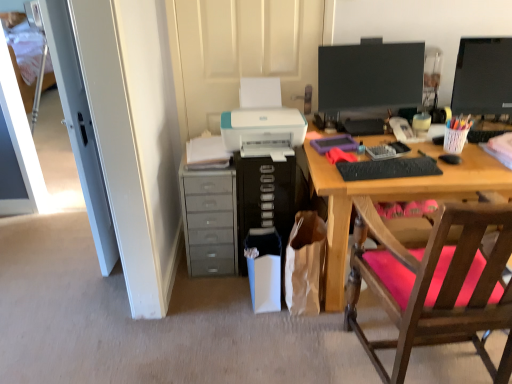
Find the location of a particular element. The image size is (512, 384). black plastic computer tower at center is located at coordinates (264, 197).

Measure the distance between point (324, 138) and camera.

2.19 meters.

Describe the element at coordinates (209, 220) in the screenshot. The height and width of the screenshot is (384, 512). I see `gray plastic drawers at lower left` at that location.

You are a GUI agent. You are given a task and a screenshot of the screen. Output one action in this format:
    pyautogui.click(x=<x>, y=<y>)
    Task: Click on the matte black monitor at upper right, the 1th computer monitor from the right
    This screenshot has height=384, width=512.
    Given the screenshot: What is the action you would take?
    pyautogui.click(x=483, y=77)

You are a GUI agent. You are given a task and a screenshot of the screen. Output one action in this format:
    pyautogui.click(x=<x>, y=<y>)
    Task: Click on the black plastic computer tower at center
    This screenshot has height=384, width=512.
    Given the screenshot: What is the action you would take?
    pyautogui.click(x=264, y=197)

Considering the relative sizes of white glossy door at left and matte black monitor at upper right, the 1th computer monitor from the right, in the image provided, is white glossy door at left bigger than matte black monitor at upper right, the 1th computer monitor from the right,?

Indeed, white glossy door at left has a larger size compared to matte black monitor at upper right, the 1th computer monitor from the right.

Considering the positions of points (71, 93) and (479, 52), is point (71, 93) farther from camera compared to point (479, 52)?

No, (71, 93) is closer to viewer.

Consider the image. Does white glossy door at left have a greater height compared to black matte keyboard at center?

Indeed, white glossy door at left has a greater height compared to black matte keyboard at center.

Considering the positions of objects white glossy door at left and black matte keyboard at center in the image provided, who is more to the right, white glossy door at left or black matte keyboard at center?

black matte keyboard at center.

How many degrees apart are the facing directions of white glossy door at left and black matte keyboard at center?

white glossy door at left and black matte keyboard at center are facing 93.7 degrees away from each other.

Which object is positioned more to the left, white paper bag at lower center or black matte keyboard at center?

white paper bag at lower center.

From the image's perspective, is white paper bag at lower center on black matte keyboard at center?

No, from the image's perspective, white paper bag at lower center is not over black matte keyboard at center.

From a real-world perspective, between white paper bag at lower center and black matte keyboard at center, who is vertically higher?

From a 3D spatial view, black matte keyboard at center is above.

Would you say white paper bag at lower center is a long distance from black matte keyboard at center?

No.

Does gray plastic drawers at lower left come in front of white glossy door at left?

No.

Which of these two, gray plastic drawers at lower left or white glossy door at left, is bigger?

With larger size is gray plastic drawers at lower left.

Where is `door above the gray plastic drawers at lower left (from the image's perspective)`? The height and width of the screenshot is (384, 512). door above the gray plastic drawers at lower left (from the image's perspective) is located at coordinates (80, 128).

Is point (220, 234) closer to viewer compared to point (106, 222)?

No, (220, 234) is further to viewer.

From the image's perspective, is white glossy door at left beneath black plastic computer tower at center?

Incorrect, from the image's perspective, white glossy door at left is higher than black plastic computer tower at center.

Is white glossy door at left oriented away from black plastic computer tower at center?

Yes, white glossy door at left is facing away from black plastic computer tower at center.

You are a GUI agent. You are given a task and a screenshot of the screen. Output one action in this format:
    pyautogui.click(x=<x>, y=<y>)
    Task: Click on the door that is in front of the black plastic computer tower at center
    
    Given the screenshot: What is the action you would take?
    pyautogui.click(x=80, y=128)

Is matte black monitor at upper right, the 2th computer monitor from the left, located outside white plastic trash can at center, the 3th stationery positioned from the top?

Yes, matte black monitor at upper right, the 2th computer monitor from the left, is outside of white plastic trash can at center, the 3th stationery positioned from the top.

From the image's perspective, which one is positioned higher, matte black monitor at upper right, the 2th computer monitor from the left, or white plastic trash can at center, which appears as the 1th stationery when ordered from the bottom?

matte black monitor at upper right, the 2th computer monitor from the left, appears higher in the image.

Consider the image. Measure the distance between matte black monitor at upper right, the 1th computer monitor from the right, and white plastic trash can at center, acting as the 1th stationery starting from the left.

They are 4.34 feet apart.

From a real-world perspective, who is located lower, matte black monitor at upper right, the 1th computer monitor from the right, or white plastic trash can at center, acting as the 1th stationery starting from the left?

white plastic trash can at center, acting as the 1th stationery starting from the left, is physically lower.

Can you confirm if black glossy monitor at upper right, which appears as the 1th computer monitor when viewed from the left, is bigger than clear plastic tray at upper right?

Correct, black glossy monitor at upper right, which appears as the 1th computer monitor when viewed from the left, is larger in size than clear plastic tray at upper right.

Can you confirm if black glossy monitor at upper right, the second computer monitor in the right-to-left sequence, is positioned to the right of clear plastic tray at upper right?

No, black glossy monitor at upper right, the second computer monitor in the right-to-left sequence, is not to the right of clear plastic tray at upper right.

In terms of width, does black glossy monitor at upper right, the second computer monitor in the right-to-left sequence, look wider or thinner when compared to clear plastic tray at upper right?

Considering their sizes, black glossy monitor at upper right, the second computer monitor in the right-to-left sequence, looks broader than clear plastic tray at upper right.

The width and height of the screenshot is (512, 384). I want to click on door that appears below the matte black monitor at upper right, the 1th computer monitor from the right (from a real-world perspective), so click(x=80, y=128).

Locate an element on the screen. keyboard behind the white glossy door at left is located at coordinates (388, 168).

Looking at the image, which one is located closer to white fabric bed at left, black glossy monitor at upper right, which appears as the 1th computer monitor when viewed from the left, or wooden chair with pink cushion at right?

Based on the image, black glossy monitor at upper right, which appears as the 1th computer monitor when viewed from the left, appears to be nearer to white fabric bed at left.

From the image, which object appears to be nearer to gray plastic drawers at lower left, white fabric bed at left or purple matte tablet at center, the second stationery ordered from the bottom?

purple matte tablet at center, the second stationery ordered from the bottom, lies closer to gray plastic drawers at lower left than the other object.

Looking at the image, which one is located further to translucent plastic pencil case at center, which ranks as the 3th stationery in bottom-to-top order, wooden chair with pink cushion at right or black plastic mouse at right?

wooden chair with pink cushion at right.

Estimate the real-world distances between objects in this image. Which object is further from clear plastic tray at upper right, white plastic trash can at center, the 3th stationery positioned from the top, or purple matte tablet at center, the 2th stationery in the top-to-bottom sequence?

The object further to clear plastic tray at upper right is white plastic trash can at center, the 3th stationery positioned from the top.

Looking at the image, which one is located further to black plastic computer tower at center, white paper bag at lower center or gray plastic drawers at lower left?

white paper bag at lower center is further to black plastic computer tower at center.

From the image, which object appears to be nearer to white paper bag at lower center, gray plastic drawers at lower left or purple matte tablet at center, the second stationery from the left?

gray plastic drawers at lower left is closer to white paper bag at lower center.

When comparing their distances from black plastic computer tower at center, does black plastic mouse at right or purple matte tablet at center, the 2th stationery in the top-to-bottom sequence, seem further?

black plastic mouse at right is positioned further to the anchor black plastic computer tower at center.

Which object lies further to the anchor point white plastic trash can at center, acting as the third stationery starting from the right, white fabric bed at left or wooden chair with pink cushion at right?

white fabric bed at left is positioned further to the anchor white plastic trash can at center, acting as the third stationery starting from the right.

The height and width of the screenshot is (384, 512). Find the location of `office supplies between black glossy monitor at upper right, the second computer monitor in the right-to-left sequence, and black plastic computer tower at center, in the vertical direction`. office supplies between black glossy monitor at upper right, the second computer monitor in the right-to-left sequence, and black plastic computer tower at center, in the vertical direction is located at coordinates (387, 150).

Where is `mouse between wooden chair with pink cushion at right and clear plastic tray at upper right along the z-axis`? Image resolution: width=512 pixels, height=384 pixels. mouse between wooden chair with pink cushion at right and clear plastic tray at upper right along the z-axis is located at coordinates (450, 159).

Find the location of a particular element. The height and width of the screenshot is (384, 512). keyboard located between gray plastic drawers at lower left and matte black monitor at upper right, the 1th computer monitor from the right, in the left-right direction is located at coordinates (388, 168).

Where is `cabinetry between white fabric bed at left and white plastic trash can at center, the 3th stationery positioned from the top, from left to right`? The image size is (512, 384). cabinetry between white fabric bed at left and white plastic trash can at center, the 3th stationery positioned from the top, from left to right is located at coordinates (209, 220).